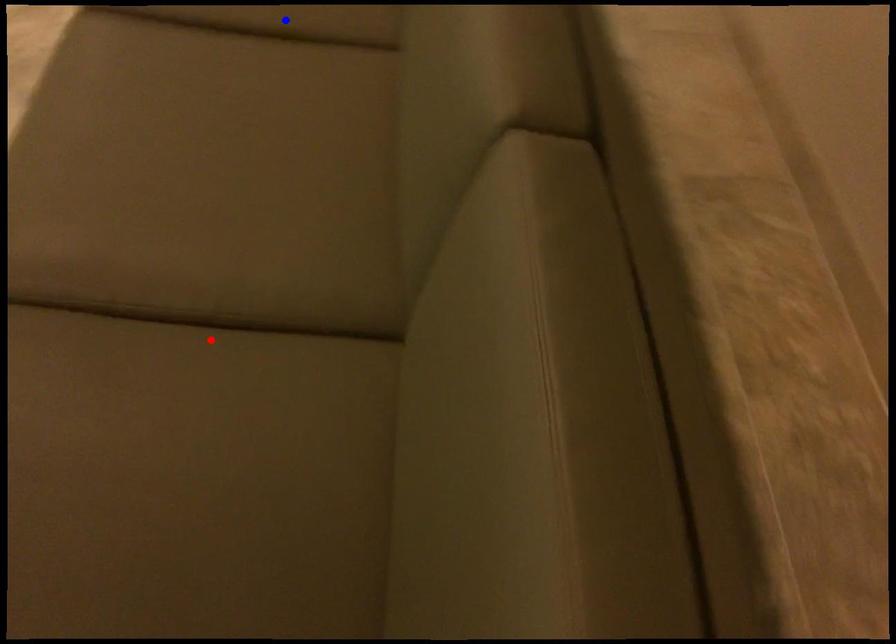
Question: In the image, two points are highlighted. Which point is nearer to the camera? Reply with the corresponding letter.

Choices:
 (A) blue point
 (B) red point

Answer: (B)